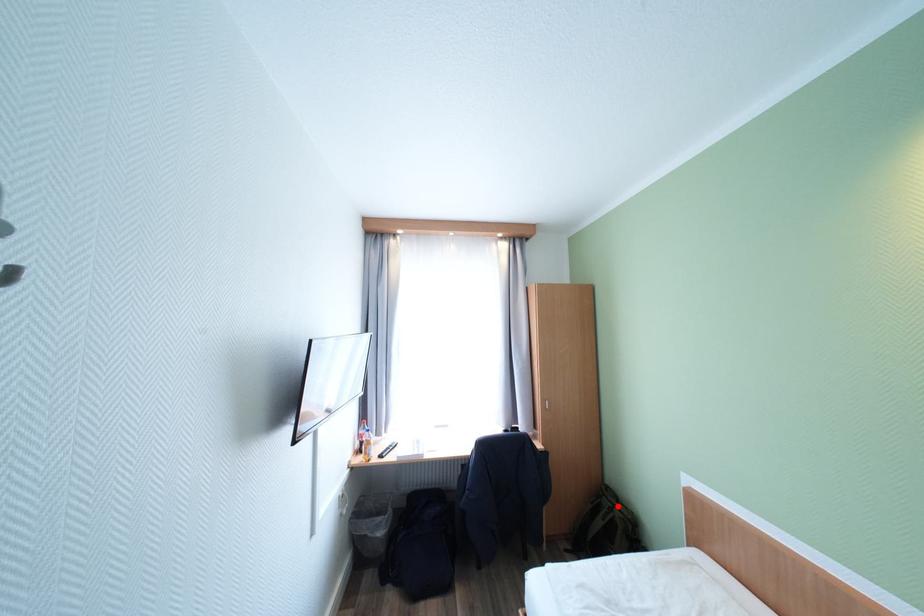
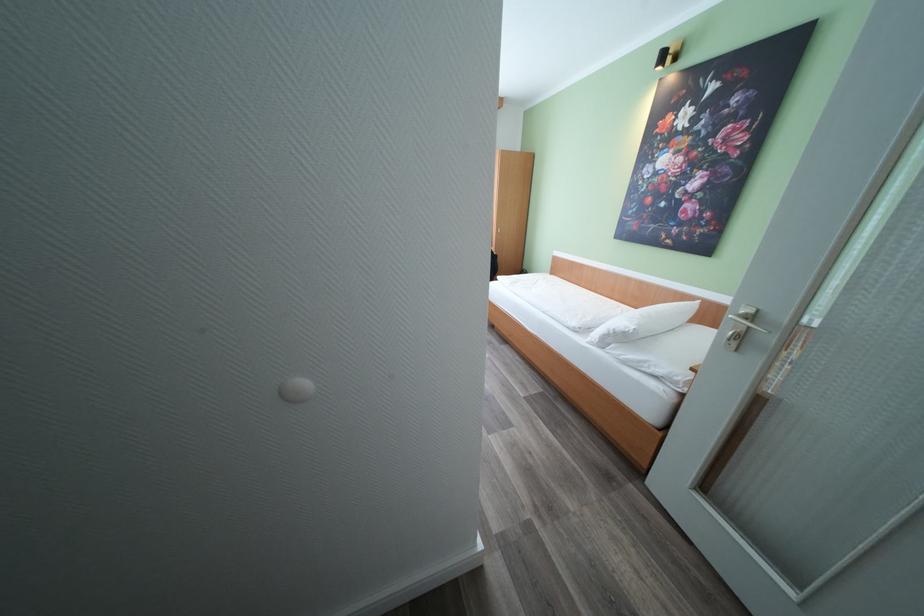
Question: I am providing you with two images of the same scene from different viewpoints. A red point is marked on the first image. At the location where the point appears in image 1, is it still visible in image 2?

Choices:
 (A) Yes
 (B) No

Answer: (B)